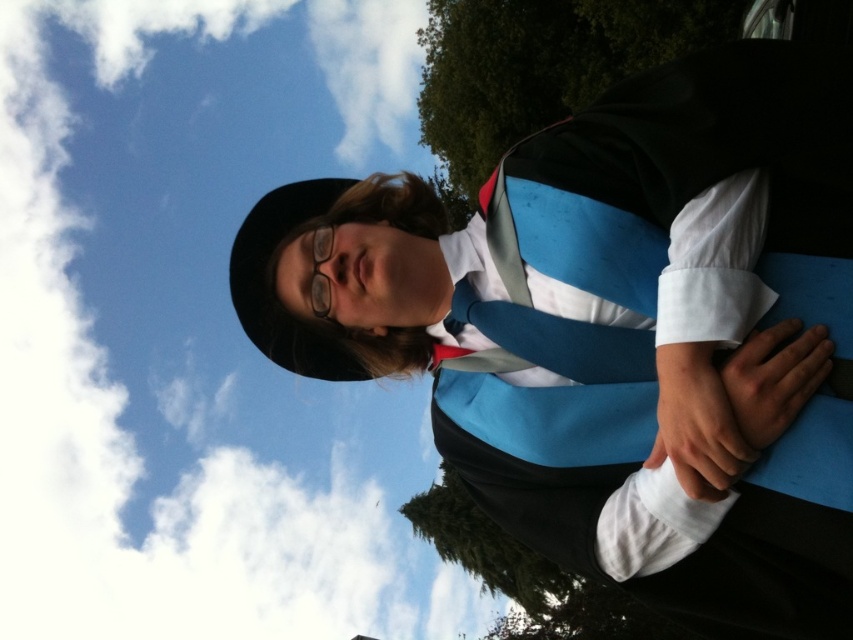
Is green leafy tree at center above transparent plastic glasses at center?

Yes.

Does green leafy tree at center have a lesser height compared to transparent plastic glasses at center?

In fact, green leafy tree at center may be taller than transparent plastic glasses at center.

The image size is (853, 640). Find the location of `green leafy tree at center`. green leafy tree at center is located at coordinates (538, 70).

Locate an element on the screen. The width and height of the screenshot is (853, 640). green leafy tree at center is located at coordinates coord(538,70).

Is green leafy tree at center bigger than green leafy tree at upper center?

Correct, green leafy tree at center is larger in size than green leafy tree at upper center.

What are the coordinates of `green leafy tree at center` in the screenshot? It's located at (538, 70).

Is point (511, 3) farther from viewer compared to point (463, 93)?

No, (511, 3) is closer to viewer.

At what (x,y) coordinates should I click in order to perform the action: click on green leafy tree at center. Please return your answer as a coordinate pair (x, y). Looking at the image, I should click on (538, 70).

Does green leafy tree at upper center have a larger size compared to transparent plastic glasses at center?

Yes.

Between green leafy tree at upper center and transparent plastic glasses at center, which one is positioned lower?

transparent plastic glasses at center

Is point (440, 19) positioned after point (316, 300)?

That is True.

At what (x,y) coordinates should I click in order to perform the action: click on green leafy tree at upper center. Please return your answer as a coordinate pair (x, y). This screenshot has width=853, height=640. Looking at the image, I should click on (538, 68).